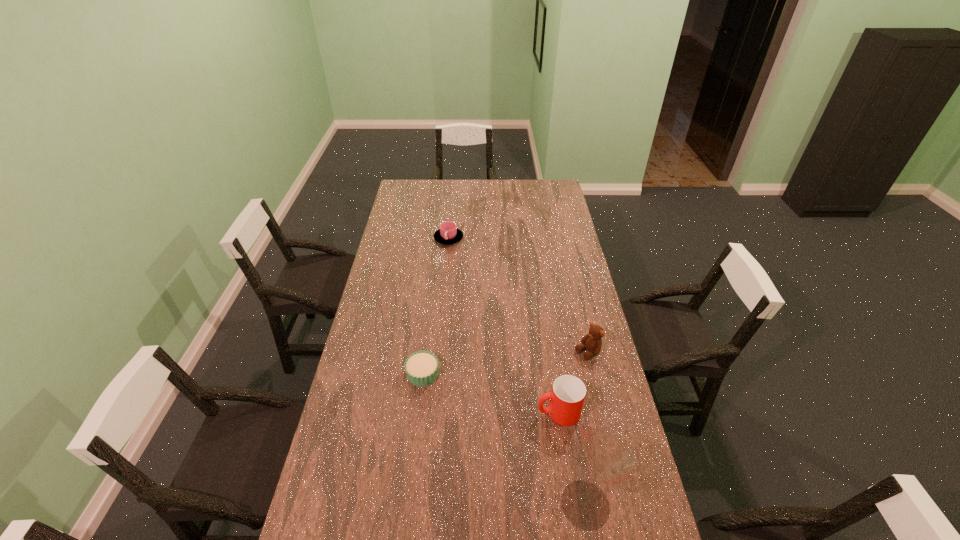
In order to click on free space on the desktop that is between the cupcake and the flute glass and is positioned on the face of the teddy bear in this screenshot , I will do `click(482, 422)`.

I want to click on free space on the desktop that is between the cupcake and the nearest object and is positioned on the side of the right cup with the handle, so click(x=483, y=422).

Identify the location of free spot on the desktop that is between the cupcake and the tallest object and is positioned on the side with the handle of the farthest object. (482, 422).